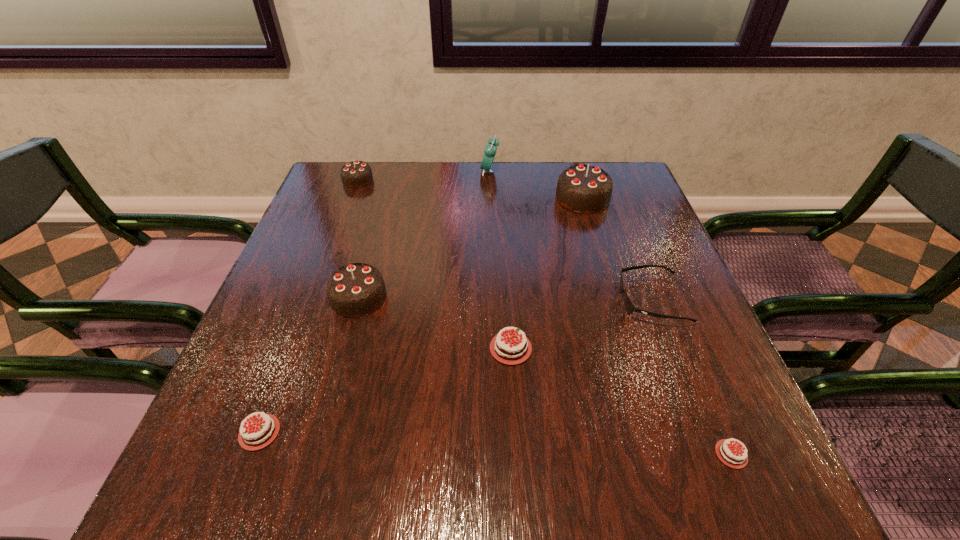
Where is `alarm clock`? The height and width of the screenshot is (540, 960). alarm clock is located at coordinates (490, 150).

Locate an element on the screen. the rightmost chocolate chocolate cake is located at coordinates (586, 189).

In order to click on the biggest chocolate chocolate cake in this screenshot , I will do `click(586, 189)`.

Image resolution: width=960 pixels, height=540 pixels. I want to click on the nearest chocolate chocolate cake, so click(x=355, y=290).

Locate an element on the screen. the second biggest chocolate chocolate cake is located at coordinates (355, 290).

Identify the location of the smallest chocolate chocolate cake. (355, 174).

Identify the location of the third tallest chocolate cake. (355, 174).

The image size is (960, 540). I want to click on the second red chocolate cake from left to right, so click(x=513, y=350).

Identify the location of the farthest red chocolate cake. This screenshot has height=540, width=960. (513, 350).

Where is `sunglasses`? sunglasses is located at coordinates (629, 306).